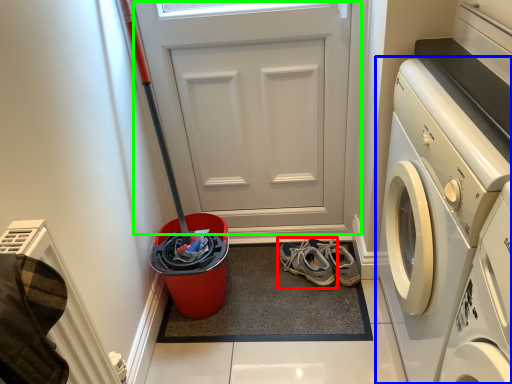
Question: Based on their relative distances, which object is nearer to footwear (highlighted by a red box)? Choose from washing machine (highlighted by a blue box) and door (highlighted by a green box).

Choices:
 (A) washing machine
 (B) door

Answer: (B)